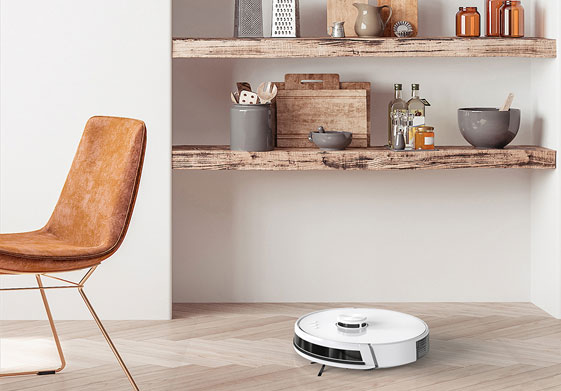
Where is `chair`? The width and height of the screenshot is (561, 391). chair is located at coordinates (62, 255).